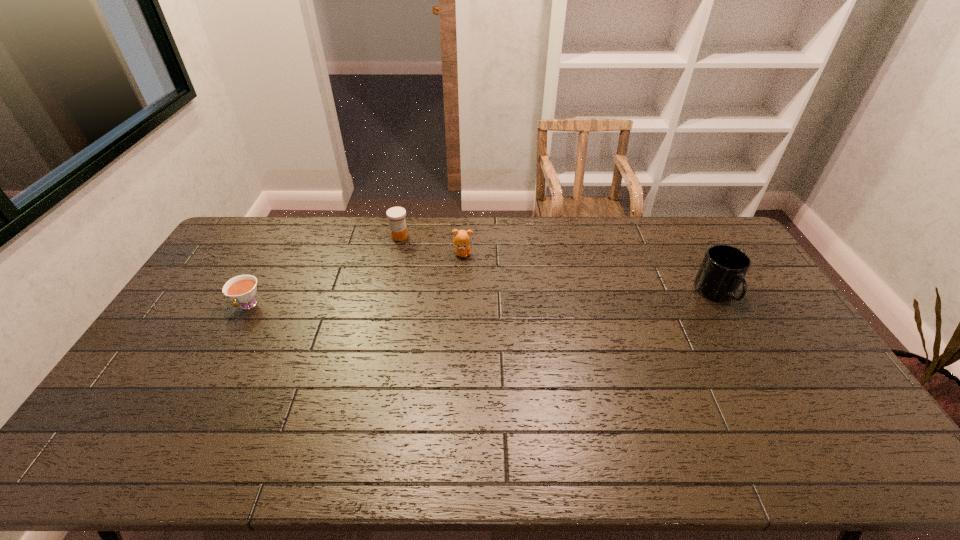
At what (x,y) coordinates should I click in order to perform the action: click on vacant space that is in between the rightmost object and the shortest object. Please return your answer as a coordinate pair (x, y). Image resolution: width=960 pixels, height=540 pixels. Looking at the image, I should click on (482, 300).

The image size is (960, 540). What are the coordinates of `vacant space that's between the leftmost object and the medicine` in the screenshot? It's located at (324, 271).

Find the location of `vacant space in between the leftmost object and the third object from right to left`. vacant space in between the leftmost object and the third object from right to left is located at coordinates (324, 271).

Locate an element on the screen. free area in between the tallest object and the second object from left to right is located at coordinates (558, 265).

I want to click on vacant space that's between the tallest object and the shortest object, so click(482, 300).

The image size is (960, 540). Find the location of `the second closest object relative to the teacup`. the second closest object relative to the teacup is located at coordinates (461, 240).

Find the location of a particular element. The width and height of the screenshot is (960, 540). object that can be found as the second closest to the leftmost object is located at coordinates (461, 240).